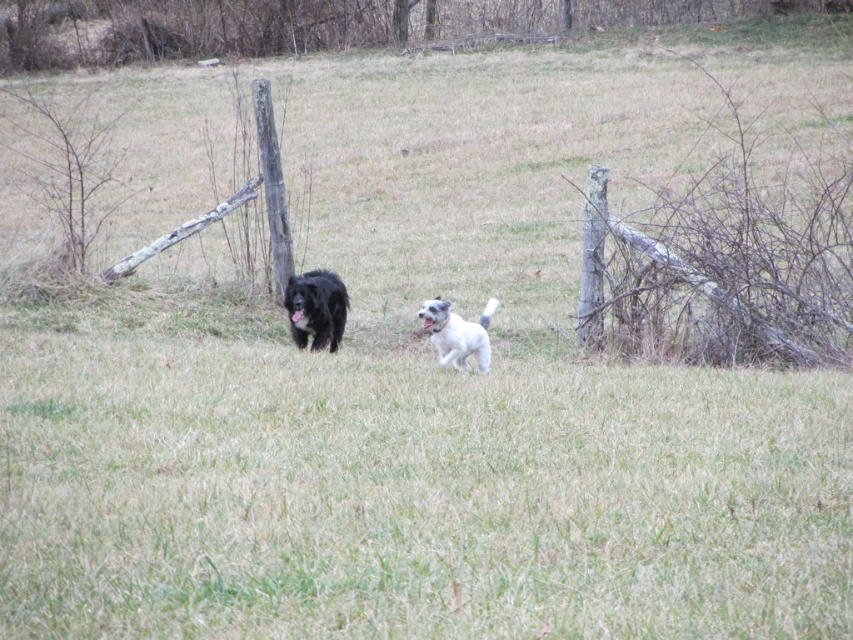
Question: Which of the following is the farthest from the observer?

Choices:
 (A) (477, 323)
 (B) (296, 292)

Answer: (B)

Question: From the image, what is the correct spatial relationship of black fluffy dog at center in relation to white fluffy dog at center?

Choices:
 (A) right
 (B) left

Answer: (B)

Question: Does black fluffy dog at center appear over white fluffy dog at center?

Choices:
 (A) no
 (B) yes

Answer: (B)

Question: Which object is closer to the camera taking this photo?

Choices:
 (A) black fluffy dog at center
 (B) white fluffy dog at center

Answer: (B)

Question: Can you confirm if black fluffy dog at center is wider than white fluffy dog at center?

Choices:
 (A) no
 (B) yes

Answer: (A)

Question: Which of the following is the farthest from the observer?

Choices:
 (A) black fluffy dog at center
 (B) white fluffy dog at center

Answer: (A)